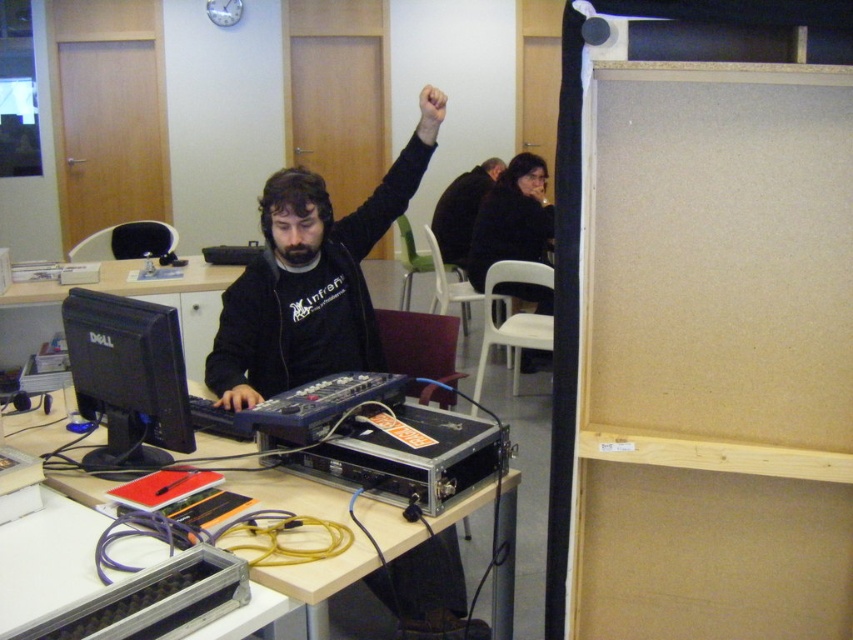
Question: Based on their relative distances, which object is farther from the black matte jacket at center?

Choices:
 (A) black matte hand at center
 (B) dark brown leather jacket at upper center
 (C) black glossy monitor at center

Answer: (B)

Question: Can you confirm if black glossy monitor at center is positioned below black matte hand at center?

Choices:
 (A) yes
 (B) no

Answer: (B)

Question: Is metallic silver table at center below black glossy monitor at center?

Choices:
 (A) no
 (B) yes

Answer: (B)

Question: Does black glossy monitor at center have a lesser width compared to dark brown leather jacket at upper center?

Choices:
 (A) no
 (B) yes

Answer: (B)

Question: Among these objects, which one is farthest from the camera?

Choices:
 (A) black matte hand at center
 (B) black matte jacket at center
 (C) dark brown leather jacket at upper center

Answer: (C)

Question: Based on their relative distances, which object is farther from the black glossy monitor at center?

Choices:
 (A) black matte hand at center
 (B) metallic silver table at center

Answer: (A)